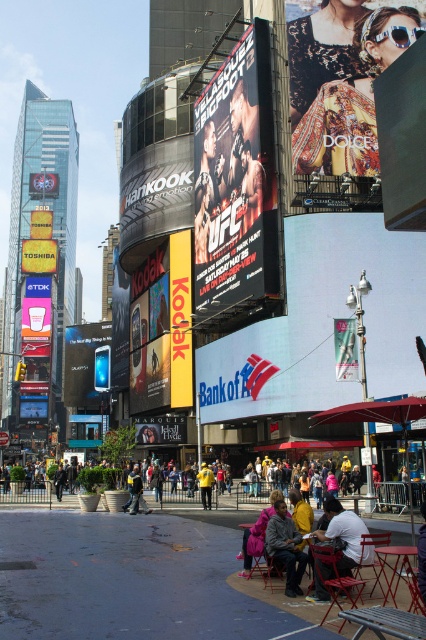
Who is lower down, patterned fabric scarf at upper right or pink fabric jacket at lower center?

pink fabric jacket at lower center is below.

Is patterned fabric scarf at upper right positioned before pink fabric jacket at lower center?

No, patterned fabric scarf at upper right is behind pink fabric jacket at lower center.

Does point (305, 81) come closer to viewer compared to point (250, 541)?

No, (305, 81) is further to viewer.

The height and width of the screenshot is (640, 426). What are the coordinates of `patterned fabric scarf at upper right` in the screenshot? It's located at (344, 92).

Which is below, metallic silver ufc poster at center or yellow plastic billboard at center?

metallic silver ufc poster at center is below.

Does metallic silver ufc poster at center have a lesser width compared to yellow plastic billboard at center?

Yes.

Find the location of a particular element. metallic silver ufc poster at center is located at coordinates (236, 179).

Between yellow cardboard kodak sign at center and pink fabric jacket at lower center, which one is positioned lower?

pink fabric jacket at lower center is lower down.

Between point (190, 396) and point (249, 554), which one is positioned in front?

Positioned in front is point (249, 554).

What are the coordinates of `yellow cardboard kodak sign at center` in the screenshot? It's located at (181, 320).